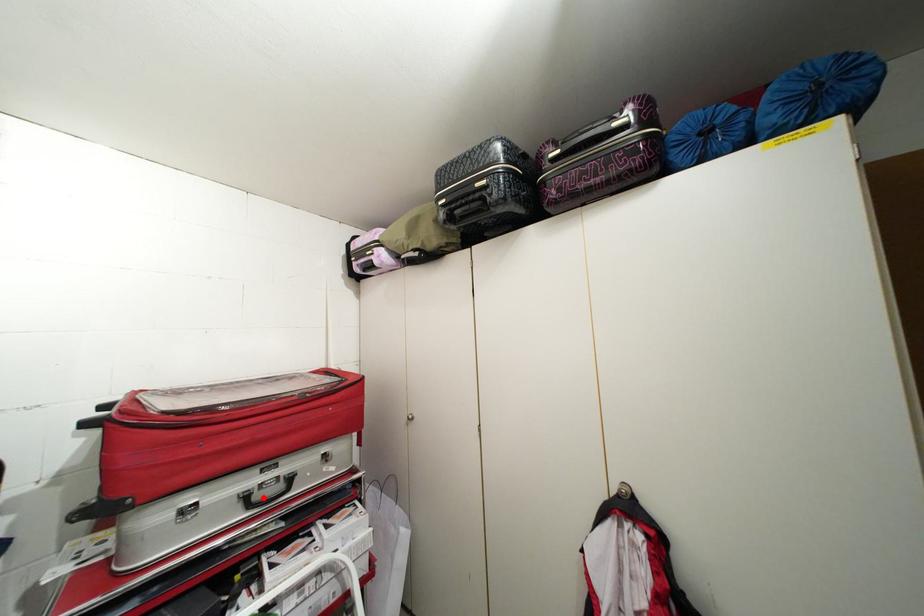
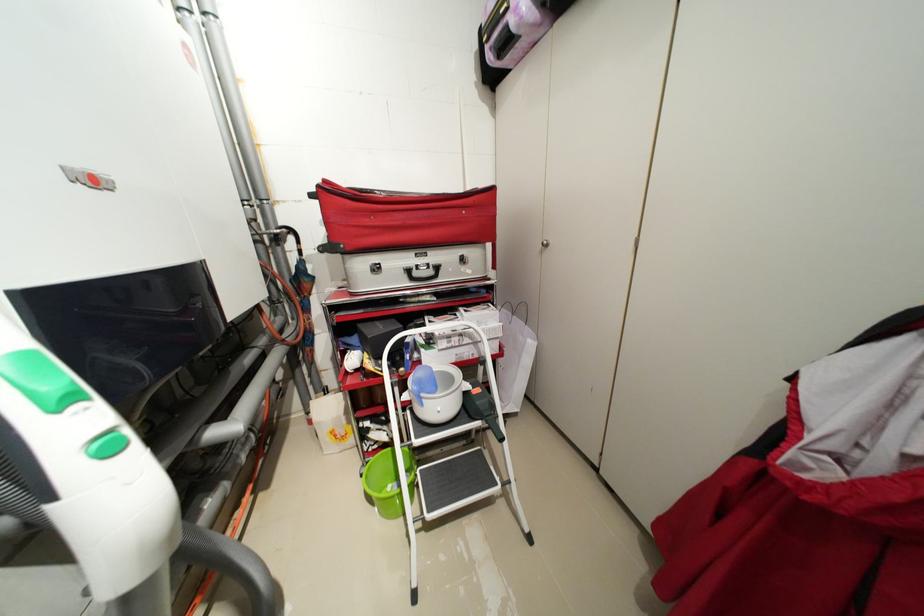
Locate, in the second image, the point that corresponds to the highlighted location in the first image.

(422, 275)